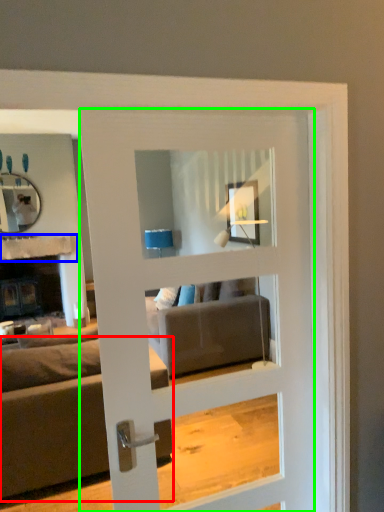
Question: Estimate the real-world distances between objects in this image. Which object is closer to studio couch (highlighted by a red box), balustrade (highlighted by a blue box) or door (highlighted by a green box)?

Choices:
 (A) balustrade
 (B) door

Answer: (B)